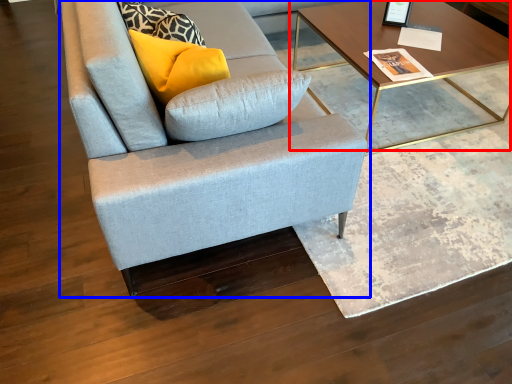
Question: Which point is further to the camera, coffee table (highlighted by a red box) or studio couch (highlighted by a blue box)?

Choices:
 (A) coffee table
 (B) studio couch

Answer: (A)